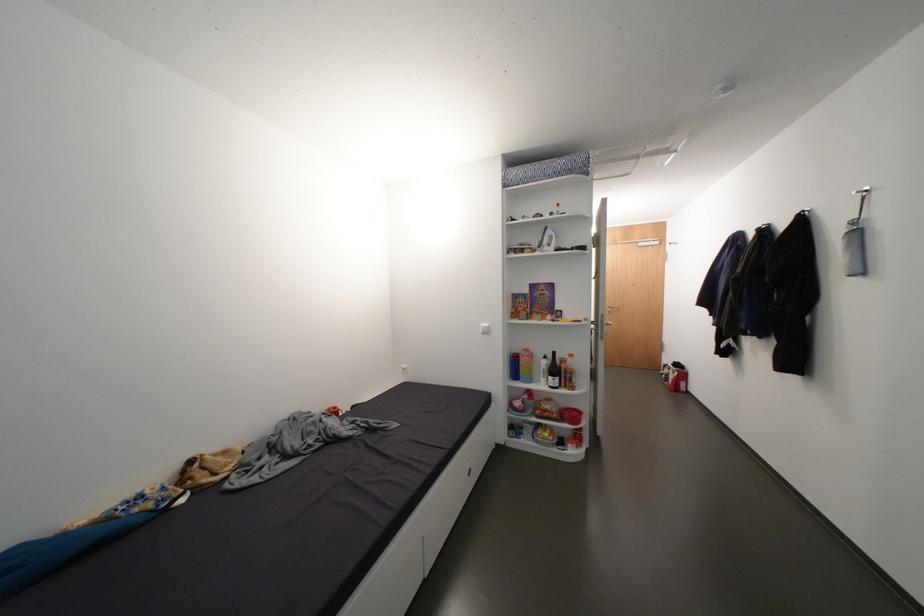
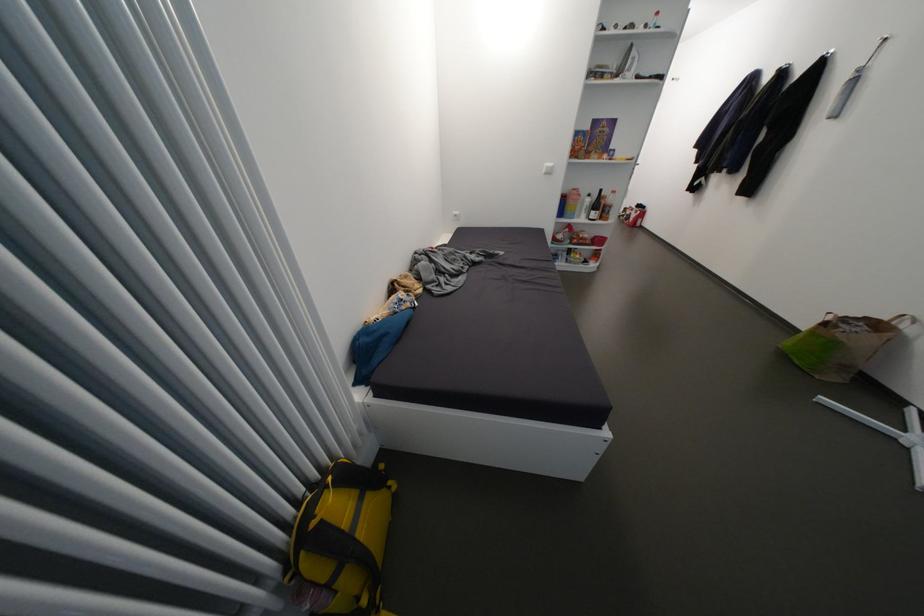
Where in the second image is the point corresponding to pixel 536 357 from the first image?

(585, 196)